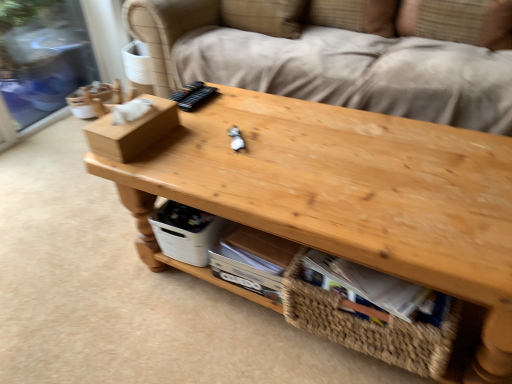
Question: Does white plastic storage box at lower center have a greater height compared to brown cardboard box at left?

Choices:
 (A) yes
 (B) no

Answer: (A)

Question: Does white plastic storage box at lower center appear on the left side of brown cardboard box at left?

Choices:
 (A) no
 (B) yes

Answer: (A)

Question: Is white plastic storage box at lower center not inside brown cardboard box at left?

Choices:
 (A) no
 (B) yes

Answer: (B)

Question: Does white plastic storage box at lower center have a larger size compared to brown cardboard box at left?

Choices:
 (A) yes
 (B) no

Answer: (A)

Question: Does white plastic storage box at lower center appear on the right side of brown cardboard box at left?

Choices:
 (A) yes
 (B) no

Answer: (A)

Question: From the image's perspective, is brown cardboard box at left above or below white plastic storage box at lower center?

Choices:
 (A) above
 (B) below

Answer: (A)

Question: Is point (161, 100) positioned closer to the camera than point (157, 236)?

Choices:
 (A) closer
 (B) farther

Answer: (A)

Question: Considering the positions of brown cardboard box at left and white plastic storage box at lower center in the image, is brown cardboard box at left wider or thinner than white plastic storage box at lower center?

Choices:
 (A) wide
 (B) thin

Answer: (A)

Question: Considering the relative positions of brown cardboard box at left and white plastic storage box at lower center in the image provided, is brown cardboard box at left to the left or to the right of white plastic storage box at lower center?

Choices:
 (A) left
 (B) right

Answer: (A)

Question: Is white plastic storage box at lower center spatially inside woven straw basket at lower center, or outside of it?

Choices:
 (A) outside
 (B) inside

Answer: (A)

Question: Based on their sizes in the image, would you say white plastic storage box at lower center is bigger or smaller than woven straw basket at lower center?

Choices:
 (A) big
 (B) small

Answer: (B)

Question: From the image's perspective, is white plastic storage box at lower center above or below woven straw basket at lower center?

Choices:
 (A) below
 (B) above

Answer: (B)

Question: Is white plastic storage box at lower center to the left or to the right of woven straw basket at lower center in the image?

Choices:
 (A) left
 (B) right

Answer: (A)

Question: Is woven straw basket at lower center taller or shorter than brown cardboard box at left?

Choices:
 (A) short
 (B) tall

Answer: (B)

Question: Considering the positions of point click(x=309, y=314) and point click(x=155, y=112), is point click(x=309, y=314) closer or farther from the camera than point click(x=155, y=112)?

Choices:
 (A) closer
 (B) farther

Answer: (A)